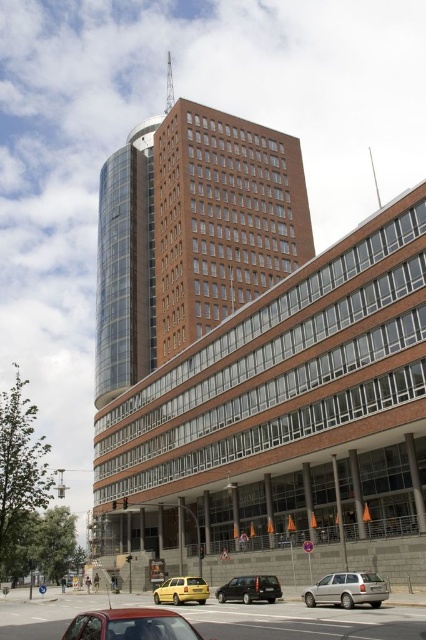
You are standing on the sidewalk in front of the building complex and notice the transparent glass tower at upper left and the silver metallic station wagon at lower right. Which object is positioned higher in the image?

The transparent glass tower at upper left is positioned higher in the image than the silver metallic station wagon at lower right.

You are an architect analyzing the building complex. You need to determine if the transparent glass tower at upper left can be seen above the matte red car at lower left from the street level. Based on their heights, what is your conclusion?

The transparent glass tower at upper left is taller than the matte red car at lower left, so yes, it can be seen above the matte red car at lower left from the street level.

You are a photographer planning to capture the modern urban building complex. You have a camera with a 50mm lens that can focus on objects within 10 meters. You are standing at the entrance of the building and see the transparent glass tower at upper left and the matte red car at lower left. Which object will your camera focus on first if you point it towards both?

The transparent glass tower at upper left has a larger size compared to the matte red car at lower left. Since the camera lens focuses on larger objects first within its range, the camera will focus on the transparent glass tower at upper left first.